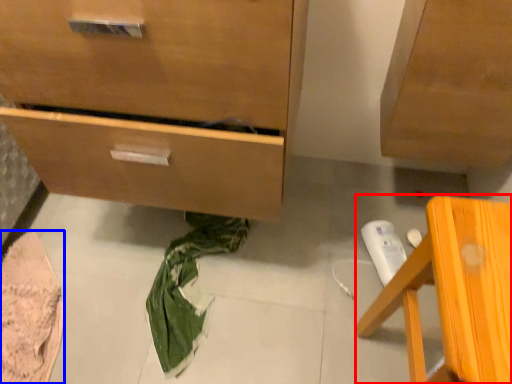
Question: Which object is further to the camera taking this photo, furniture (highlighted by a red box) or material (highlighted by a blue box)?

Choices:
 (A) furniture
 (B) material

Answer: (B)